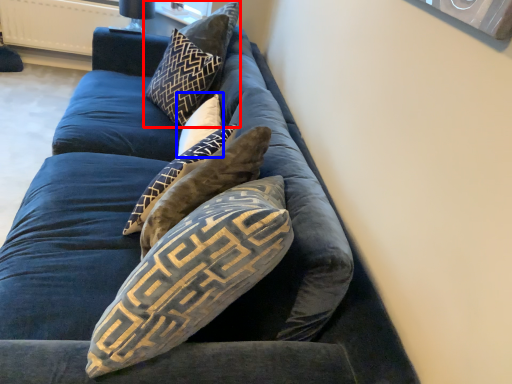
Question: Which of the following is the closest to the observer, pillow (highlighted by a red box) or pillow (highlighted by a blue box)?

Choices:
 (A) pillow
 (B) pillow

Answer: (B)